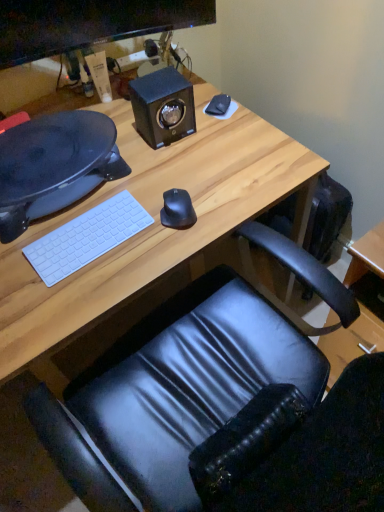
At what (x,y) coordinates should I click in order to perform the action: click on free space to the right of white matte keyboard at lower left. Please return your answer as a coordinate pair (x, y). Image resolution: width=384 pixels, height=512 pixels. Looking at the image, I should click on (163, 225).